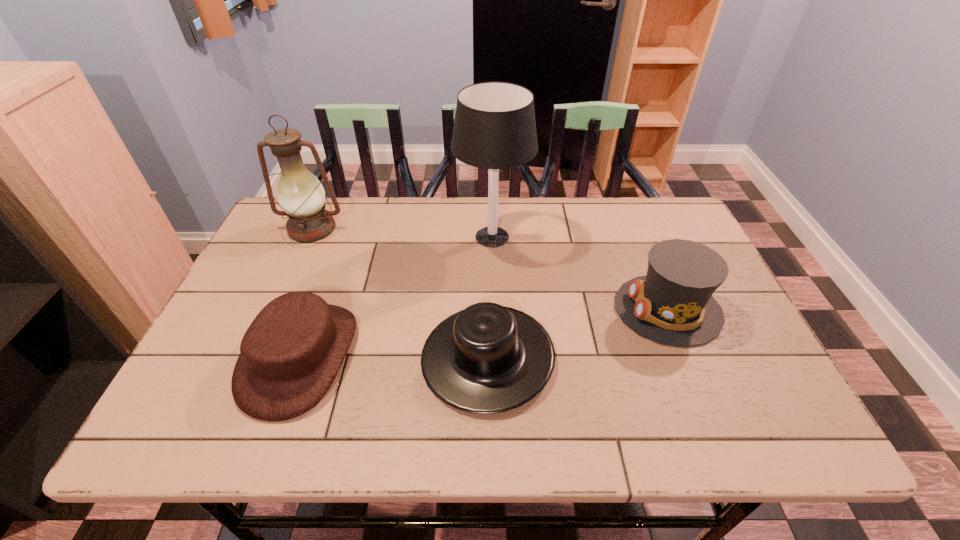
Where is `free spot at the far edge of the desktop`? This screenshot has width=960, height=540. free spot at the far edge of the desktop is located at coordinates (433, 221).

In the image, there is a desktop. At what (x,y) coordinates should I click in order to perform the action: click on free region at the near edge. Please return your answer as a coordinate pair (x, y). This screenshot has width=960, height=540. Looking at the image, I should click on (259, 423).

You are a GUI agent. You are given a task and a screenshot of the screen. Output one action in this format:
    pyautogui.click(x=<x>, y=<y>)
    Task: Click on the vacant space at the left edge
    This screenshot has height=540, width=960.
    Given the screenshot: What is the action you would take?
    pyautogui.click(x=282, y=278)

In the image, there is a desktop. At what (x,y) coordinates should I click in order to perform the action: click on vacant region at the right edge. Please return your answer as a coordinate pair (x, y). This screenshot has width=960, height=540. Looking at the image, I should click on (729, 384).

What are the coordinates of `free point between the rightmost hat and the second tallest object` in the screenshot? It's located at (490, 269).

I want to click on vacant region between the second hat from right to left and the table lamp, so click(x=490, y=297).

The height and width of the screenshot is (540, 960). I want to click on unoccupied area between the second hat from right to left and the rightmost hat, so click(x=578, y=333).

Locate an element on the screen. The image size is (960, 540). free space that is in between the leftmost hat and the table lamp is located at coordinates (396, 297).

At what (x,y) coordinates should I click in order to perform the action: click on unoccupied position between the oil lamp and the table lamp. Please return your answer as a coordinate pair (x, y). The width and height of the screenshot is (960, 540). Looking at the image, I should click on [402, 233].

In order to click on vacant area between the table lamp and the leftmost hat in this screenshot , I will do `click(396, 297)`.